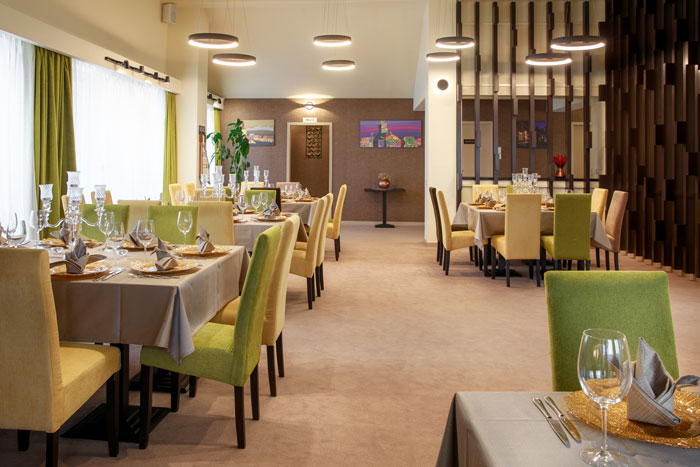
You are a GUI agent. You are given a task and a screenshot of the screen. Output one action in this format:
    pyautogui.click(x=<x>, y=<y>)
    Task: Click on the lamps
    
    Given the screenshot: What is the action you would take?
    pyautogui.click(x=218, y=43), pyautogui.click(x=244, y=59), pyautogui.click(x=335, y=40), pyautogui.click(x=337, y=66), pyautogui.click(x=452, y=44), pyautogui.click(x=441, y=60), pyautogui.click(x=540, y=64), pyautogui.click(x=580, y=43)